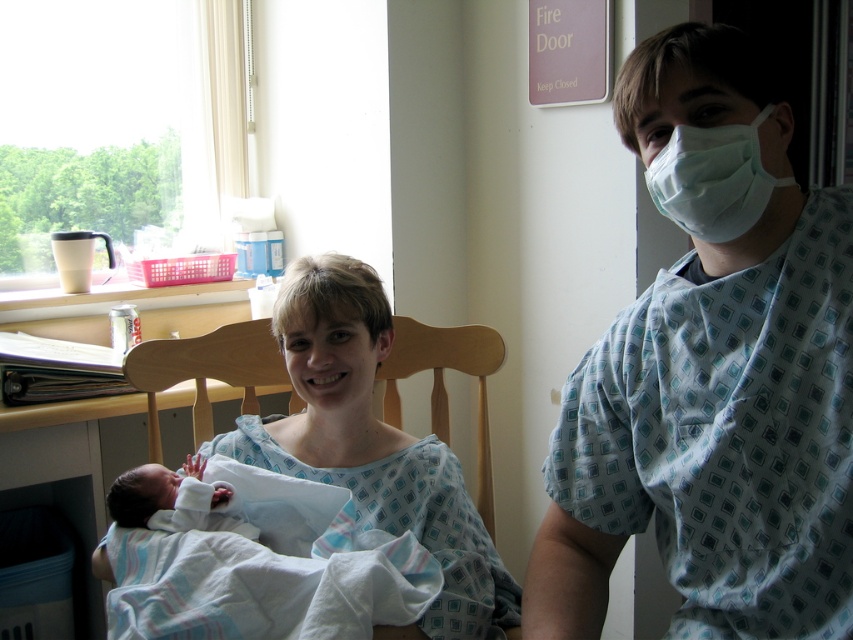
Identify the location of light blue printed scrubs at right. (712, 392).

Which is more to the right, light blue printed scrubs at right or white medical mask at upper right?

From the viewer's perspective, white medical mask at upper right appears more on the right side.

Can you confirm if light blue printed scrubs at right is positioned above white medical mask at upper right?

No, light blue printed scrubs at right is not above white medical mask at upper right.

Is point (758, 339) behind point (695, 200)?

Yes, point (758, 339) is behind point (695, 200).

Locate an element on the screen. The width and height of the screenshot is (853, 640). light blue printed scrubs at right is located at coordinates (712, 392).

Is wooden chair at center positioned in front of white medical mask at upper right?

That is False.

Does point (434, 376) come closer to viewer compared to point (759, 198)?

No, (434, 376) is behind (759, 198).

I want to click on wooden chair at center, so click(x=206, y=371).